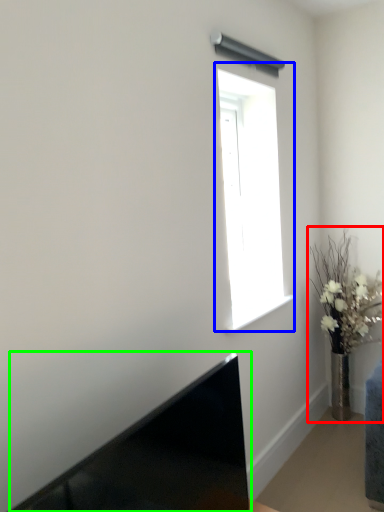
Question: Which object is the closest to the houseplant (highlighted by a red box)? Choose among these: window (highlighted by a blue box) or laptop (highlighted by a green box).

Choices:
 (A) window
 (B) laptop

Answer: (A)